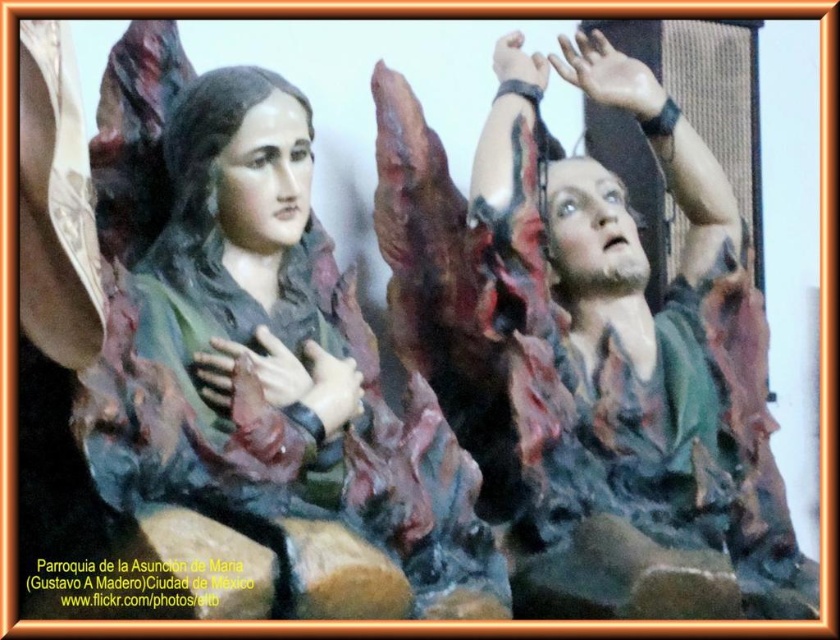
Is matte green statue at upper right thinner than matte green stone at center?

No, matte green statue at upper right is not thinner than matte green stone at center.

Between point (555, 342) and point (240, 544), which one is positioned in front?

Point (240, 544)

Who is more distant from viewer, (552, 342) or (255, 572)?

Point (552, 342)

Locate an element on the screen. The image size is (840, 640). matte green statue at upper right is located at coordinates (634, 387).

Can you confirm if brown matte stone at center is positioned to the left of matte brown hand at center?

In fact, brown matte stone at center is to the right of matte brown hand at center.

Is point (318, 540) positioned before point (326, 394)?

Yes, point (318, 540) is closer to viewer.

Who is more forward, [327,609] or [298,401]?

Point [327,609] is more forward.

I want to click on brown matte stone at center, so click(x=339, y=573).

Does matte green statue at center appear on the right side of matte brown hand at center?

No, matte green statue at center is not to the right of matte brown hand at center.

Who is more forward, [248,97] or [333,368]?

Point [333,368]

At what (x,y) coordinates should I click in order to perform the action: click on matte green statue at center. Please return your answer as a coordinate pair (x, y). Image resolution: width=840 pixels, height=640 pixels. Looking at the image, I should click on (261, 353).